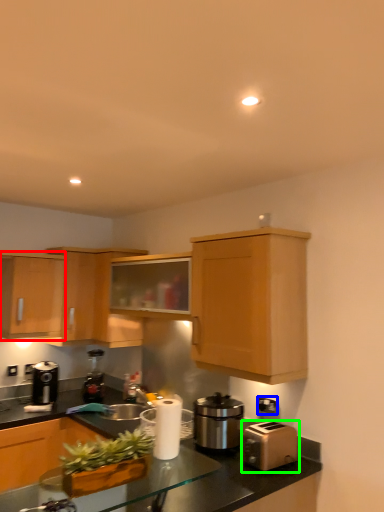
Question: Estimate the real-world distances between objects in this image. Which object is closer to cabinetry (highlighted by a red box), electric outlet (highlighted by a blue box) or toaster (highlighted by a green box)?

Choices:
 (A) electric outlet
 (B) toaster

Answer: (A)